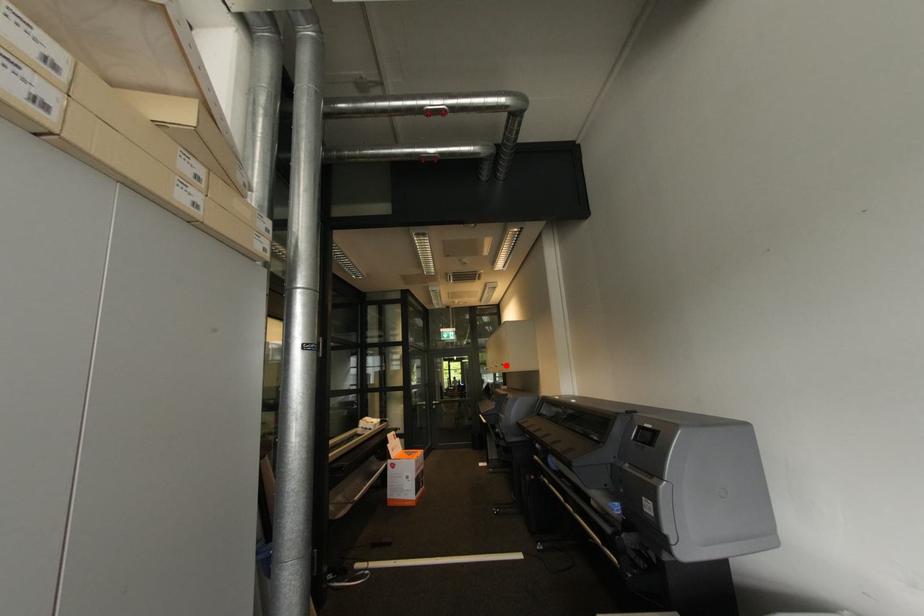
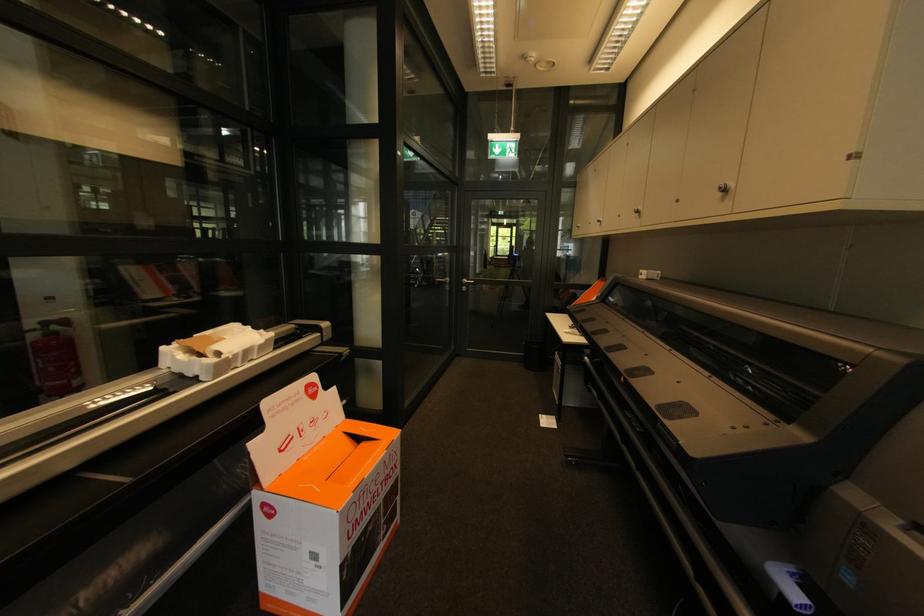
Find the pixel in the second image that matches the highlighted location in the first image.

(727, 191)